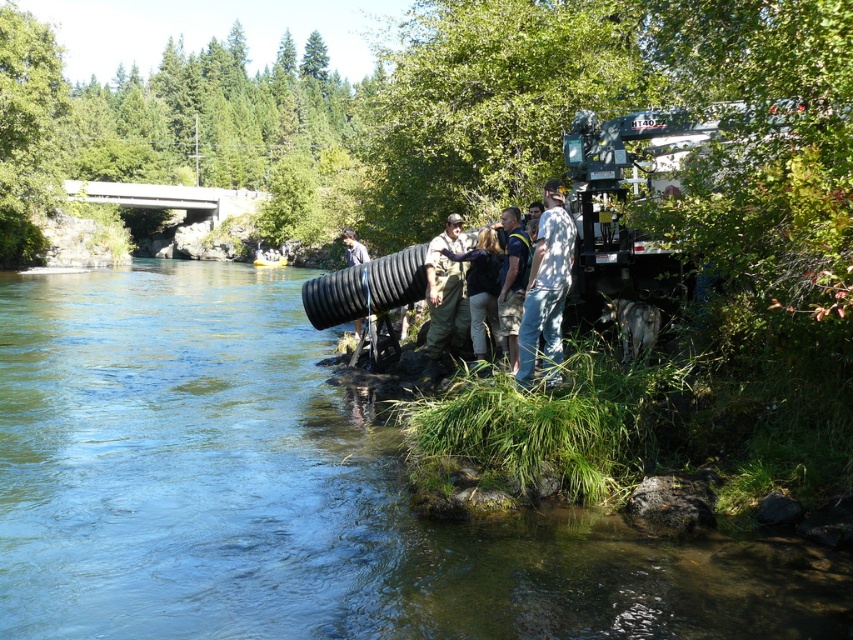
Based on the photo, you are a construction worker standing at the edge of the river. You need to place a marker at point (299, 493). Is this point located on the clear water at river right?

Yes, the point (299, 493) is on clear water at river right.

In the scene shown: You are a photographer trying to capture a clear shot of the dark brown leather jacket at center without the camouflage pants at center blocking it. Is the jacket visible from your current position?

The camouflage pants at center is positioned over dark brown leather jacket at center, so the dark brown leather jacket at center is partially or fully obscured and may not be fully visible.

You are a photographer trying to capture a closeup of the camouflage pants at center and the blue fabric shirt at center. Which clothing item would require you to step back to get both in frame without zooming?

The camouflage pants at center is wider than the blue fabric shirt at center, so you would need to step back to include both in the frame without zooming.